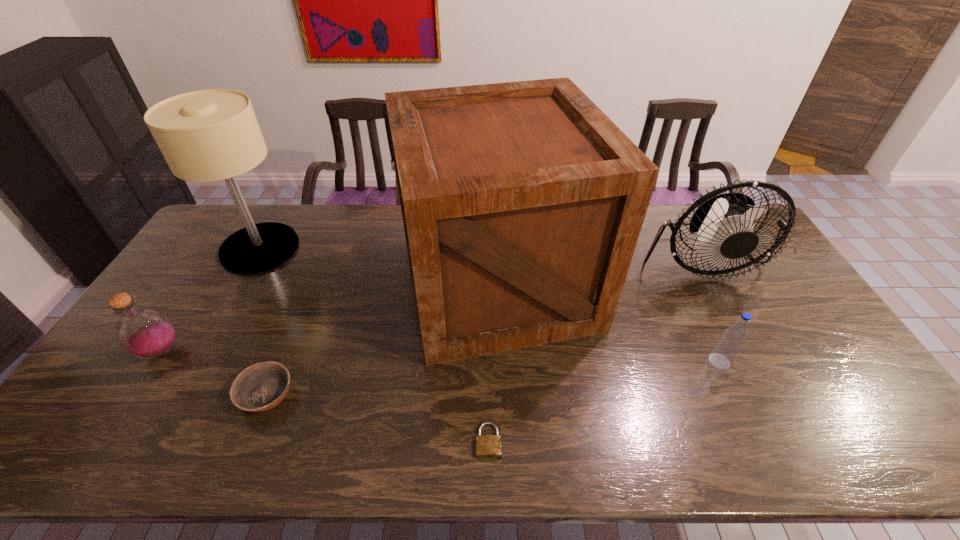
You are a GUI agent. You are given a task and a screenshot of the screen. Output one action in this format:
    pyautogui.click(x=<x>, y=<y>)
    Task: Click on the vacant space situated on the right of the table lamp
    
    Given the screenshot: What is the action you would take?
    pyautogui.click(x=335, y=248)

This screenshot has width=960, height=540. Find the location of `vacant region located in front of the third tallest object, directing airflow`. vacant region located in front of the third tallest object, directing airflow is located at coordinates (770, 391).

Find the location of `vacant region located on the front of the bottle`. vacant region located on the front of the bottle is located at coordinates (134, 393).

This screenshot has width=960, height=540. Find the location of `vacant region located on the left of the water bottle`. vacant region located on the left of the water bottle is located at coordinates (665, 361).

Locate an element on the screen. This screenshot has width=960, height=540. vacant point located 0.120m on the right of the sixth farthest object is located at coordinates (342, 395).

In order to click on box present at the far edge in this screenshot , I will do `click(522, 202)`.

The height and width of the screenshot is (540, 960). In order to click on table lamp that is at the far edge in this screenshot , I will do `click(208, 135)`.

Find the location of a particular element. The width and height of the screenshot is (960, 540). fan located in the far edge section of the desktop is located at coordinates (721, 228).

Identify the location of object that is at the near edge. (487, 446).

Image resolution: width=960 pixels, height=540 pixels. Identify the location of table lamp present at the left edge. (208, 135).